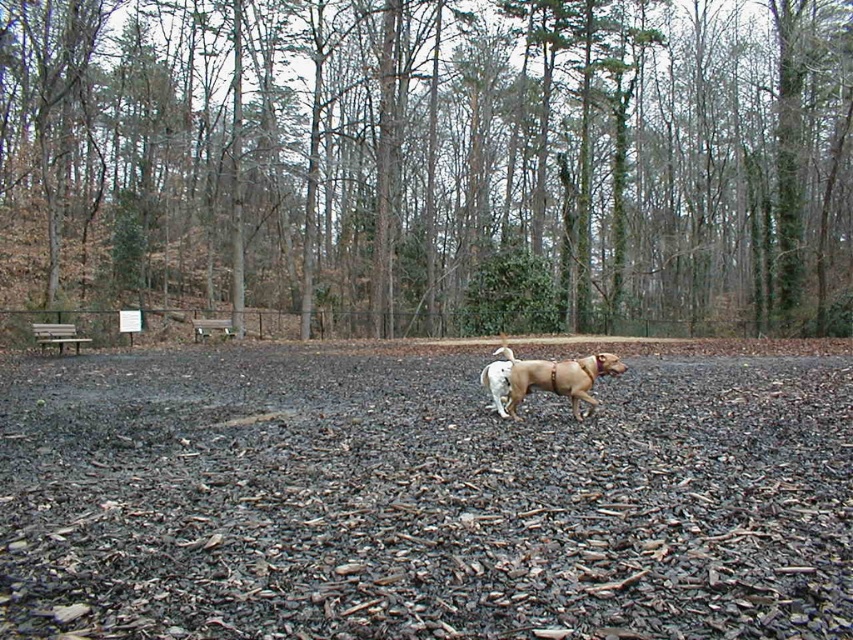
Question: Does dark brown mulch at center appear over wooden bench at left?

Choices:
 (A) no
 (B) yes

Answer: (A)

Question: Which point is closer to the camera?

Choices:
 (A) (74, 330)
 (B) (805, 232)
 (C) (605, 358)

Answer: (C)

Question: Which of the following is the farthest from the observer?

Choices:
 (A) (308, 68)
 (B) (364, 444)
 (C) (198, 333)

Answer: (A)

Question: Can you confirm if green leafy tree at center is smaller than brown wooden bench at center?

Choices:
 (A) yes
 (B) no

Answer: (B)

Question: Which of the following is the closest to the observer?

Choices:
 (A) pos(837,595)
 (B) pos(628,248)
 (C) pos(79,337)
 (D) pos(233,333)

Answer: (A)

Question: Is green leafy tree at center below dark brown mulch at center?

Choices:
 (A) no
 (B) yes

Answer: (A)